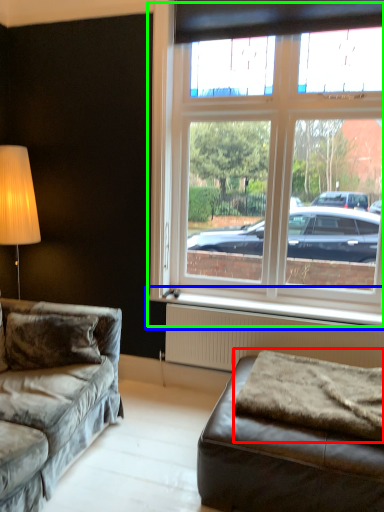
Question: Considering the real-world distances, which object is closest to blanket (highlighted by a red box)? window sill (highlighted by a blue box) or window (highlighted by a green box).

Choices:
 (A) window sill
 (B) window

Answer: (A)